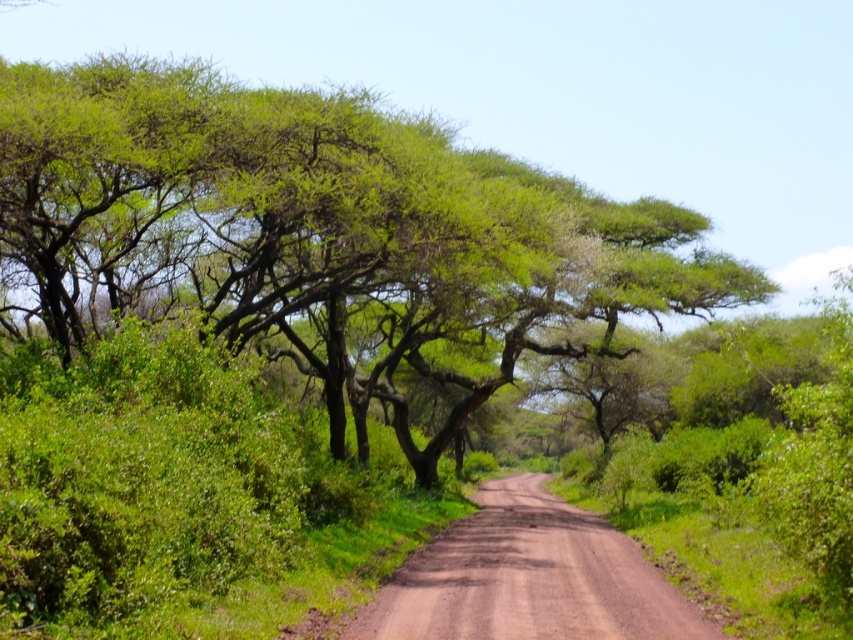
Is point (194, 186) positioned in front of point (567, 556)?

Yes.

Between point (383, 291) and point (515, 528), which one is positioned behind?

The point (515, 528) is behind.

Does point (196, 230) come behind point (508, 536)?

Yes, point (196, 230) is farther from viewer.

Where is `green leafy tree at center`? green leafy tree at center is located at coordinates [318, 236].